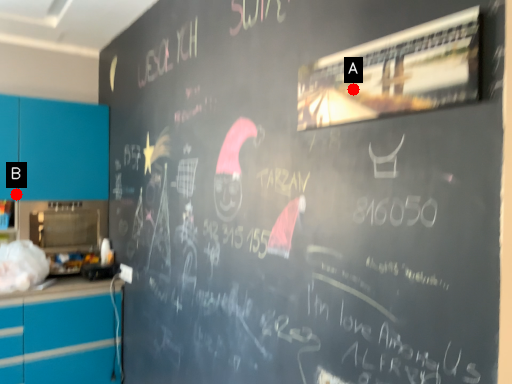
Question: Two points are circled on the image, labeled by A and B beside each circle. Which point is farther from the camera taking this photo?

Choices:
 (A) A is further
 (B) B is further

Answer: (B)